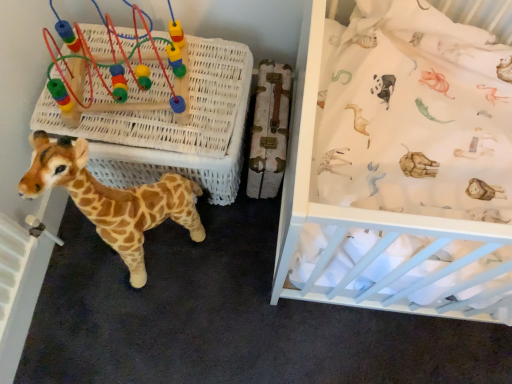
Find the location of a particular element. The height and width of the screenshot is (384, 512). vacant space underneath soft plush giraffe at lower left (from a real-world perspective) is located at coordinates (158, 250).